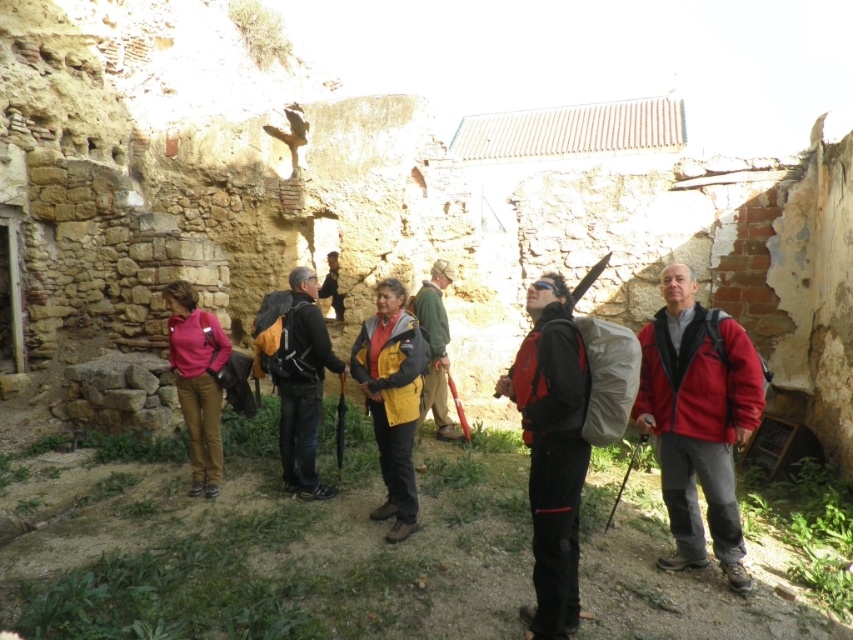
Between red fleece jacket at center and green fabric jacket at center, which one appears on the left side from the viewer's perspective?

From the viewer's perspective, green fabric jacket at center appears more on the left side.

Is red fleece jacket at center further to camera compared to green fabric jacket at center?

No, it is in front of green fabric jacket at center.

Locate an element on the screen. The height and width of the screenshot is (640, 853). red fleece jacket at center is located at coordinates (697, 419).

Can you confirm if matte black backpack at center is positioned above green fabric jacket at center?

Correct, matte black backpack at center is located above green fabric jacket at center.

Is matte black backpack at center smaller than green fabric jacket at center?

No.

The image size is (853, 640). I want to click on matte black backpack at center, so click(297, 376).

The height and width of the screenshot is (640, 853). Identify the location of matte pink jacket at center-left. (196, 381).

Is point (206, 378) positioned behind point (453, 269)?

No.

At what (x,y) coordinates should I click in order to perform the action: click on matte pink jacket at center-left. Please return your answer as a coordinate pair (x, y). The image size is (853, 640). Looking at the image, I should click on (196, 381).